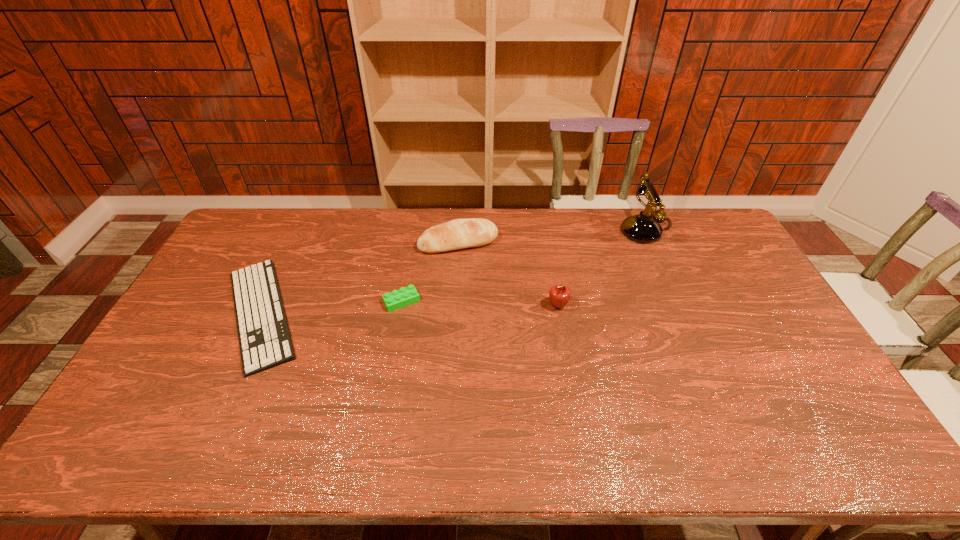
Identify the location of blank space located on the left of the bread. (355, 242).

Locate an element on the screen. The image size is (960, 540). vacant region located 0.400m on the right of the apple is located at coordinates (696, 306).

I want to click on free space located on the front of the Lego, so click(x=389, y=373).

Locate an element on the screen. This screenshot has width=960, height=540. vacant region located on the right of the shortest object is located at coordinates (387, 314).

Identify the location of telephone at the far edge. This screenshot has height=540, width=960. (643, 228).

The height and width of the screenshot is (540, 960). I want to click on bread located at the far edge, so click(456, 234).

You are a GUI agent. You are given a task and a screenshot of the screen. Output one action in this format:
    pyautogui.click(x=<x>, y=<y>)
    Task: Click on the object located in the left edge section of the desktop
    Image resolution: width=960 pixels, height=540 pixels.
    Given the screenshot: What is the action you would take?
    pyautogui.click(x=264, y=338)

Identify the location of blank space at the far edge. (328, 240).

This screenshot has height=540, width=960. In the image, there is a desktop. What are the coordinates of `free space at the near edge` in the screenshot? It's located at (770, 457).

This screenshot has height=540, width=960. I want to click on vacant area at the left edge, so click(x=206, y=341).